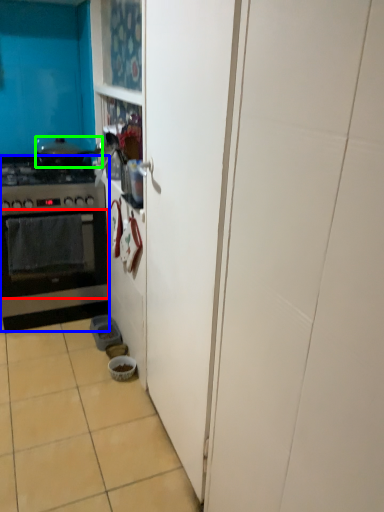
Question: Based on their relative distances, which object is farther from oven (highlighted by a red box)? Choose from kitchen appliance (highlighted by a blue box) and pot/pan (highlighted by a green box).

Choices:
 (A) kitchen appliance
 (B) pot/pan

Answer: (B)